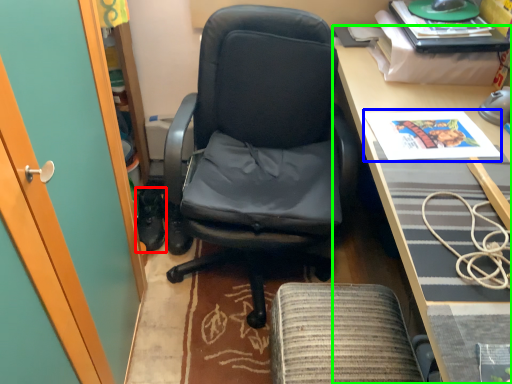
Question: Estimate the real-world distances between objects in this image. Which object is farther from footwear (highlighted by a red box), magazine (highlighted by a blue box) or desk (highlighted by a green box)?

Choices:
 (A) magazine
 (B) desk

Answer: (A)